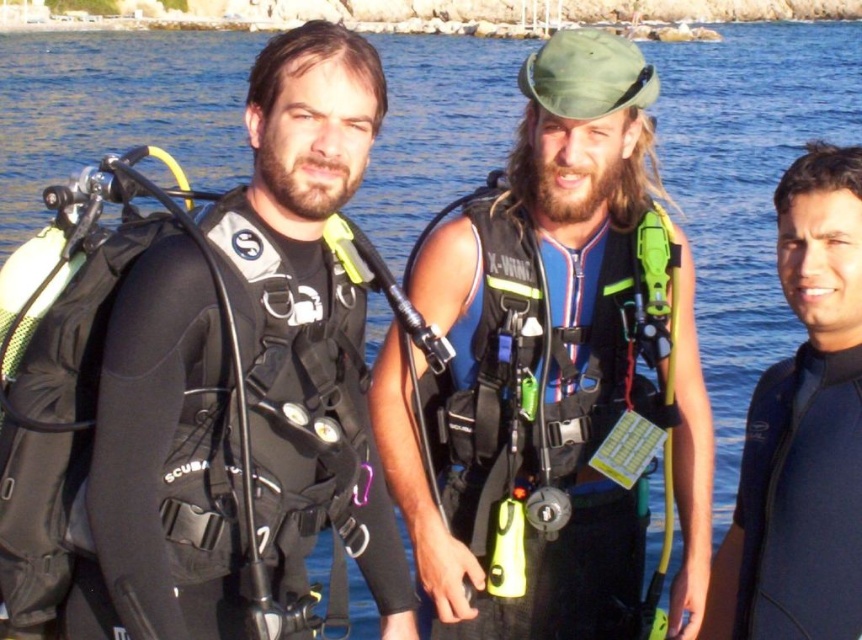
Question: From the image, what is the correct spatial relationship of matte black wetsuit at center in relation to black matte wetsuit at left?

Choices:
 (A) left
 (B) right

Answer: (B)

Question: Which point is farther to the camera?

Choices:
 (A) (616, 209)
 (B) (778, 486)

Answer: (A)

Question: Which object is closer to the camera taking this photo?

Choices:
 (A) matte black wetsuit at center
 (B) black matte wetsuit at right

Answer: (B)

Question: In this image, where is matte black wetsuit at center located relative to black matte wetsuit at right?

Choices:
 (A) above
 (B) below

Answer: (A)

Question: Which of the following is the farthest from the observer?

Choices:
 (A) (275, 588)
 (B) (826, 314)

Answer: (B)

Question: Does matte black wetsuit at center appear on the left side of black matte wetsuit at left?

Choices:
 (A) yes
 (B) no

Answer: (B)